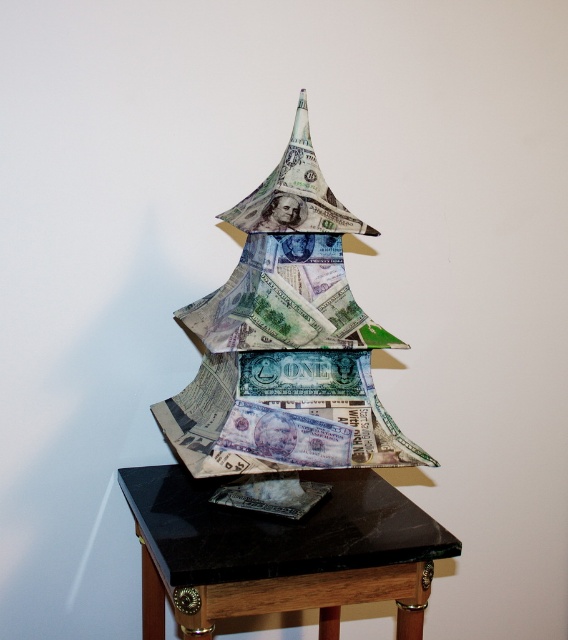
Consider the image. You are an art curator examining the origami Christmas tree. You notice two points on the tree at coordinates point (241, 358) and point (148, 513). Which point is positioned closer to your viewpoint?

Point (241, 358) is closer to the viewer than point (148, 513).